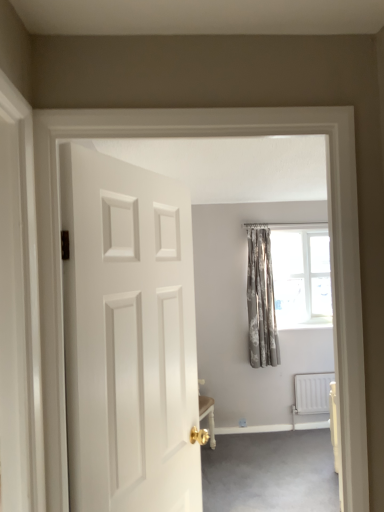
The width and height of the screenshot is (384, 512). What do you see at coordinates (312, 393) in the screenshot? I see `white metallic radiator at lower right` at bounding box center [312, 393].

Find the location of a particular element. The height and width of the screenshot is (512, 384). carpet at lower right is located at coordinates (270, 472).

Based on their sizes in the image, would you say silver textured curtains at center is bigger or smaller than carpet at lower right?

Clearly, silver textured curtains at center is larger in size than carpet at lower right.

Is the position of silver textured curtains at center less distant than that of carpet at lower right?

No, it is behind carpet at lower right.

Measure the distance between silver textured curtains at center and carpet at lower right.

1.10 meters.

From the image's perspective, is silver textured curtains at center over carpet at lower right?

Yes, from the image's perspective, silver textured curtains at center is on top of carpet at lower right.

Is point (93, 236) farther from viewer compared to point (321, 240)?

No.

Is white matte door at center next to patterned fabric curtain at upper right?

white matte door at center is not next to patterned fabric curtain at upper right, and they're not touching.

Does white matte door at center have a smaller size compared to patterned fabric curtain at upper right?

Actually, white matte door at center might be larger than patterned fabric curtain at upper right.

From a real-world perspective, which object rests below the other?

In real-world perspective, carpet at lower right is lower.

Can you confirm if white matte door at center is taller than carpet at lower right?

Yes, white matte door at center is taller than carpet at lower right.

In terms of size, does white matte door at center appear bigger or smaller than carpet at lower right?

white matte door at center is bigger than carpet at lower right.

The image size is (384, 512). I want to click on door on the left of carpet at lower right, so click(x=128, y=337).

Is silver textured curtains at center oriented towards white matte door at center?

No, silver textured curtains at center is not turned towards white matte door at center.

Considering the positions of objects silver textured curtains at center and white matte door at center in the image provided, who is more to the right, silver textured curtains at center or white matte door at center?

From the viewer's perspective, silver textured curtains at center appears more on the right side.

Is white matte door at center completely or partially inside silver textured curtains at center?

No, white matte door at center is not inside silver textured curtains at center.

Does white matte door at center have a lesser height compared to white metallic radiator at lower right?

In fact, white matte door at center may be taller than white metallic radiator at lower right.

How much distance is there between white matte door at center and white metallic radiator at lower right?

3.05 meters.

From the image's perspective, which is above, white matte door at center or white metallic radiator at lower right?

white matte door at center, from the image's perspective.

From a real-world perspective, is white matte door at center positioned above or below white metallic radiator at lower right?

white matte door at center is above white metallic radiator at lower right.

Is white metallic radiator at lower right positioned with its back to silver textured curtains at center?

No.

From a real-world perspective, is white metallic radiator at lower right on silver textured curtains at center?

Incorrect, from a real-world perspective, white metallic radiator at lower right is lower than silver textured curtains at center.

Who is smaller, white metallic radiator at lower right or silver textured curtains at center?

With smaller size is white metallic radiator at lower right.

Based on the photo, is white metallic radiator at lower right behind silver textured curtains at center?

Yes, it is.

From a real-world perspective, is silver textured curtains at center below white metallic radiator at lower right?

Incorrect, from a real-world perspective, silver textured curtains at center is higher than white metallic radiator at lower right.

Between silver textured curtains at center and white metallic radiator at lower right, which one has larger width?

Wider between the two is silver textured curtains at center.

Is silver textured curtains at center spatially inside white metallic radiator at lower right, or outside of it?

silver textured curtains at center is not enclosed by white metallic radiator at lower right.

Which is behind, point (274, 345) or point (307, 388)?

Positioned behind is point (307, 388).

The height and width of the screenshot is (512, 384). Find the location of `curtain on the left side of carpet at lower right`. curtain on the left side of carpet at lower right is located at coordinates (261, 300).

Where is `door in front of the patterned fabric curtain at upper right`? The width and height of the screenshot is (384, 512). door in front of the patterned fabric curtain at upper right is located at coordinates (128, 337).

From the image, which object appears to be farther from white metallic radiator at lower right, white matte door at center or carpet at lower right?

white matte door at center lies further to white metallic radiator at lower right than the other object.

When comparing their distances from silver textured curtains at center, does patterned fabric curtain at upper right or white matte door at center seem further?

white matte door at center lies further to silver textured curtains at center than the other object.

Estimate the real-world distances between objects in this image. Which object is further from white metallic radiator at lower right, silver textured curtains at center or carpet at lower right?

carpet at lower right is positioned further to the anchor white metallic radiator at lower right.

Looking at the image, which one is located further to carpet at lower right, white metallic radiator at lower right or white matte door at center?

white matte door at center.

Estimate the real-world distances between objects in this image. Which object is closer to patterned fabric curtain at upper right, white metallic radiator at lower right or white matte door at center?

Among the two, white metallic radiator at lower right is located nearer to patterned fabric curtain at upper right.

Based on their spatial positions, is white matte door at center or white metallic radiator at lower right further from carpet at lower right?

Among the two, white matte door at center is located further to carpet at lower right.

When comparing their distances from white matte door at center, does carpet at lower right or silver textured curtains at center seem closer?

The object closer to white matte door at center is carpet at lower right.

Looking at the image, which one is located further to carpet at lower right, white metallic radiator at lower right or silver textured curtains at center?

silver textured curtains at center.

Find the location of a particular element. This screenshot has width=384, height=512. plain between white matte door at center and white metallic radiator at lower right from front to back is located at coordinates (270, 472).

Identify the location of curtain between white matte door at center and white metallic radiator at lower right in the front-back direction. (261, 300).

This screenshot has height=512, width=384. I want to click on plain located between white matte door at center and patterned fabric curtain at upper right in the depth direction, so click(270, 472).

The image size is (384, 512). I want to click on plain between white matte door at center and silver textured curtains at center from front to back, so 270,472.